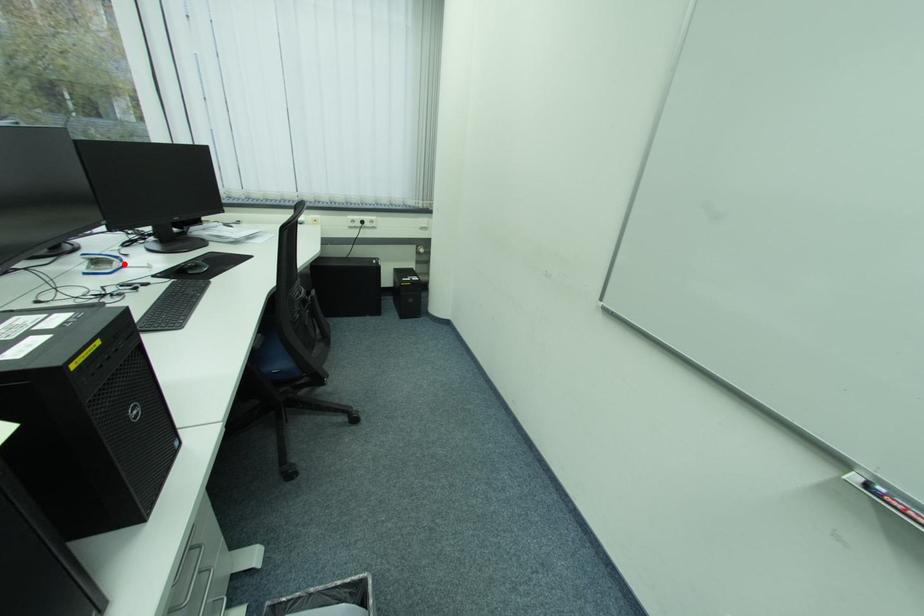
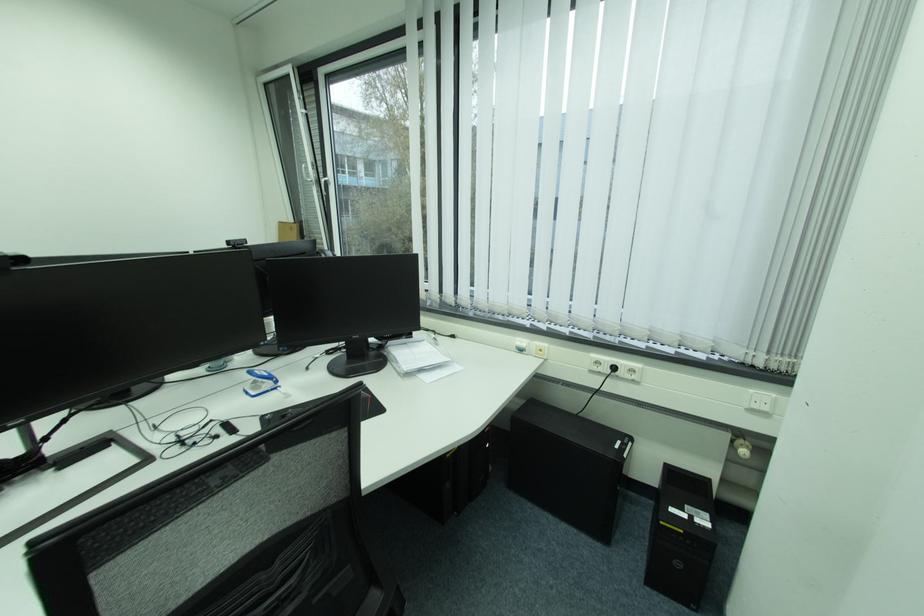
Find the pixel in the second image that matches the highlighted location in the first image.

(275, 386)